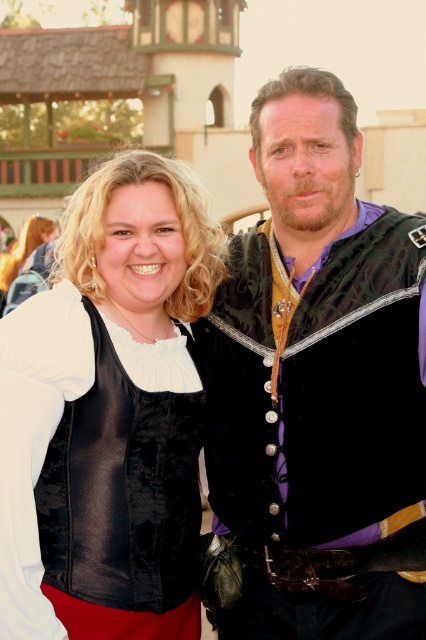
You are standing at a distance of 100 feet from the image. A point labeled as point (342, 109) is present in the image. Is this point closer to you or farther away than your current position?

The point (342, 109) is 83.84 feet away from the viewer, which is closer than your current position of 100 feet.